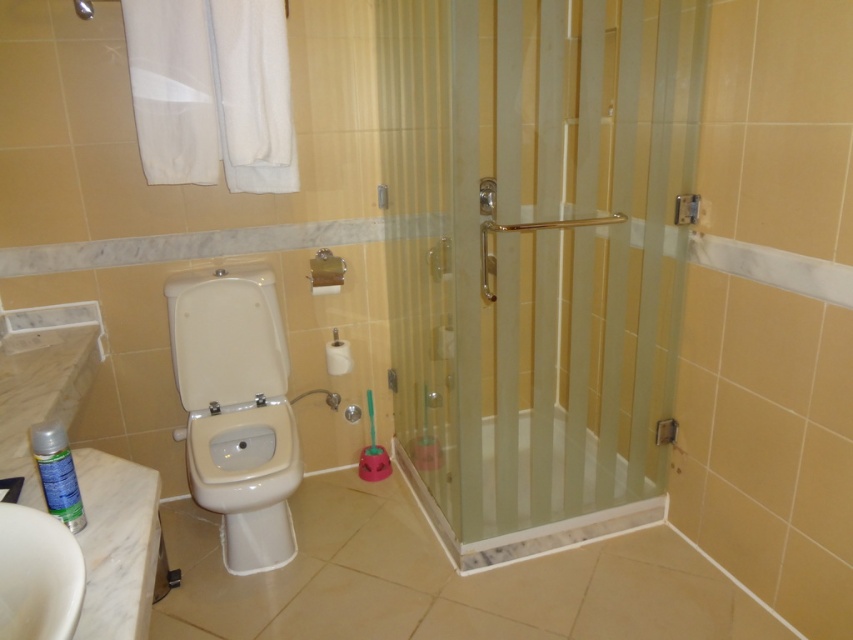
Is point (250, 381) farther from camera compared to point (49, 492)?

Yes, point (250, 381) is behind point (49, 492).

Image resolution: width=853 pixels, height=640 pixels. Find the location of `white glossy toilet at left`. white glossy toilet at left is located at coordinates (236, 410).

Looking at this image, can you confirm if clear glass shower door at right is bigger than green matte spray can at lower left?

Correct, clear glass shower door at right is larger in size than green matte spray can at lower left.

Can you confirm if clear glass shower door at right is positioned below green matte spray can at lower left?

No.

Is point (624, 96) closer to viewer compared to point (38, 445)?

No, it is not.

Where is `clear glass shower door at right`? The image size is (853, 640). clear glass shower door at right is located at coordinates (535, 259).

Measure the distance between point (482, 467) and camera.

Point (482, 467) is 7.60 feet from camera.

Is clear glass shower door at right wider than white glossy toilet at left?

Yes, clear glass shower door at right is wider than white glossy toilet at left.

Between point (498, 445) and point (207, 378), which one is positioned in front?

Positioned in front is point (498, 445).

At what (x,y) coordinates should I click in order to perform the action: click on clear glass shower door at right. Please return your answer as a coordinate pair (x, y). The image size is (853, 640). Looking at the image, I should click on (535, 259).